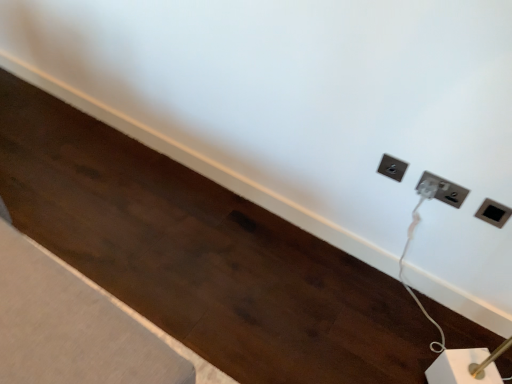
Question: Is black plastic socket at upper right, the 1th power plugs and sockets from the right, wider than white plastic power plug at upper right, which is the second power plugs and sockets in left-to-right order?

Choices:
 (A) yes
 (B) no

Answer: (B)

Question: Is there a large distance between black plastic socket at upper right, the 1th power plugs and sockets from the right, and white plastic power plug at upper right, placed as the second power plugs and sockets when sorted from right to left?

Choices:
 (A) no
 (B) yes

Answer: (A)

Question: Is black plastic socket at upper right, the 1th power plugs and sockets from the right, oriented away from white plastic power plug at upper right, which is the second power plugs and sockets in left-to-right order?

Choices:
 (A) yes
 (B) no

Answer: (B)

Question: Is white plastic power plug at upper right, which is the second power plugs and sockets in left-to-right order, completely or partially inside black plastic socket at upper right, placed as the third power plugs and sockets when sorted from left to right?

Choices:
 (A) no
 (B) yes

Answer: (A)

Question: From the image's perspective, is black plastic socket at upper right, placed as the third power plugs and sockets when sorted from left to right, on top of white plastic power plug at upper right, which is the second power plugs and sockets in left-to-right order?

Choices:
 (A) no
 (B) yes

Answer: (A)

Question: In the image, is white plastic power plug at upper right, placed as the second power plugs and sockets when sorted from right to left, positioned in front of or behind black plastic socket at upper right, the 1th power plugs and sockets from the right?

Choices:
 (A) behind
 (B) front

Answer: (A)

Question: Would you say white plastic power plug at upper right, placed as the second power plugs and sockets when sorted from right to left, is inside or outside black plastic socket at upper right, placed as the third power plugs and sockets when sorted from left to right?

Choices:
 (A) inside
 (B) outside

Answer: (B)

Question: From the image's perspective, is white plastic power plug at upper right, which is the second power plugs and sockets in left-to-right order, above or below black plastic socket at upper right, the 1th power plugs and sockets from the right?

Choices:
 (A) above
 (B) below

Answer: (A)

Question: In terms of height, does white plastic power plug at upper right, placed as the second power plugs and sockets when sorted from right to left, look taller or shorter compared to black plastic socket at upper right, placed as the third power plugs and sockets when sorted from left to right?

Choices:
 (A) short
 (B) tall

Answer: (A)

Question: Considering the positions of black plastic socket at upper right, the 1th power plugs and sockets from the right, and black plastic power plugs and sockets at upper right, marked as the 3th power plugs and sockets in a right-to-left arrangement, in the image, is black plastic socket at upper right, the 1th power plugs and sockets from the right, taller or shorter than black plastic power plugs and sockets at upper right, marked as the 3th power plugs and sockets in a right-to-left arrangement,?

Choices:
 (A) short
 (B) tall

Answer: (B)

Question: Based on their positions, is black plastic socket at upper right, the 1th power plugs and sockets from the right, located to the left or right of black plastic power plugs and sockets at upper right, arranged as the 1th power plugs and sockets when viewed from the left?

Choices:
 (A) right
 (B) left

Answer: (A)

Question: Considering the positions of point (502, 210) and point (390, 168), is point (502, 210) closer or farther from the camera than point (390, 168)?

Choices:
 (A) farther
 (B) closer

Answer: (B)

Question: Relative to black plastic power plugs and sockets at upper right, arranged as the 1th power plugs and sockets when viewed from the left, is black plastic socket at upper right, the 1th power plugs and sockets from the right, in front or behind?

Choices:
 (A) behind
 (B) front

Answer: (B)

Question: Considering their positions, is black plastic power plugs and sockets at upper right, marked as the 3th power plugs and sockets in a right-to-left arrangement, located in front of or behind white plastic power plug at upper right, which is the second power plugs and sockets in left-to-right order?

Choices:
 (A) behind
 (B) front

Answer: (A)

Question: In terms of width, does black plastic power plugs and sockets at upper right, arranged as the 1th power plugs and sockets when viewed from the left, look wider or thinner when compared to white plastic power plug at upper right, which is the second power plugs and sockets in left-to-right order?

Choices:
 (A) wide
 (B) thin

Answer: (A)